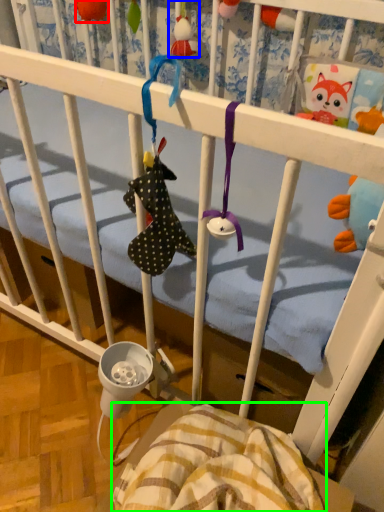
Question: Which object is positioned closest to toy (highlighted by a red box)? Select from toy (highlighted by a blue box) and blanket (highlighted by a green box).

Choices:
 (A) toy
 (B) blanket

Answer: (A)